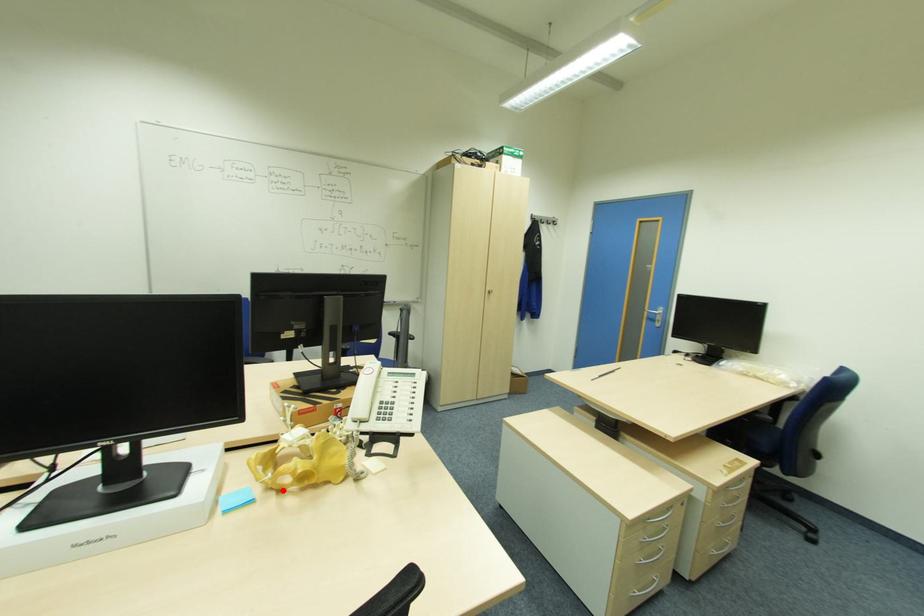
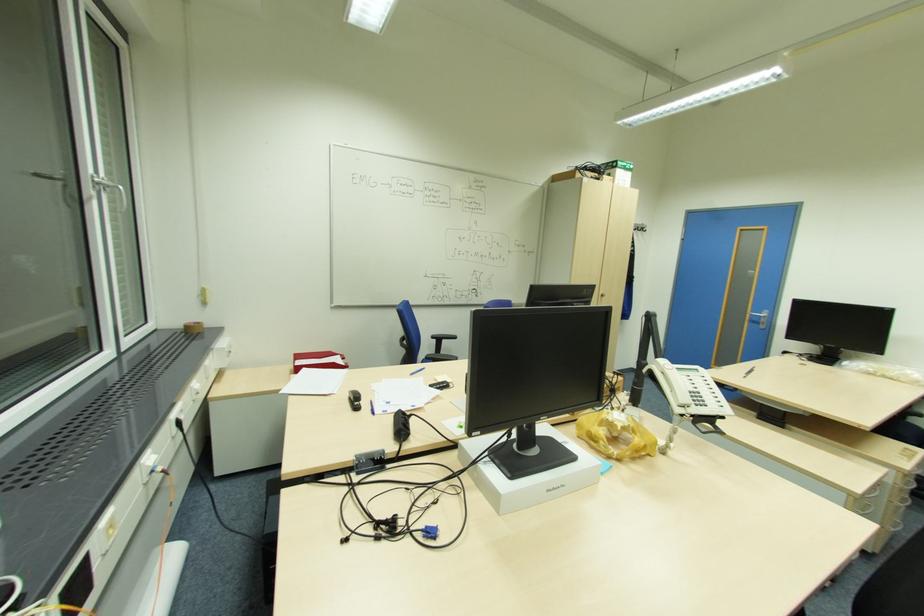
Locate, in the second image, the point that corresponds to the highlighted location in the first image.

(621, 459)